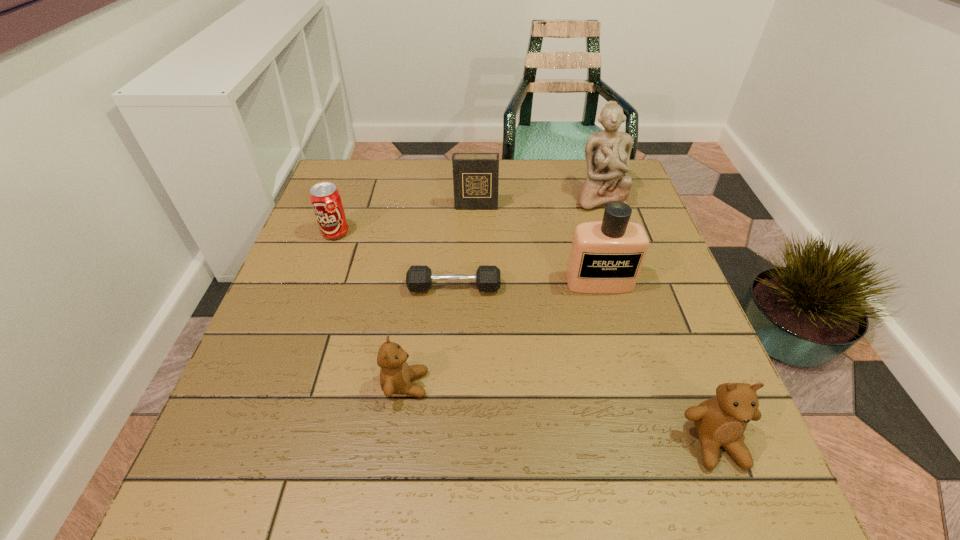
If equal spacing is the goal by inserting an additional teddy_bear among them, please point out a vacant space for this new teddy_bear. Please provide its 2D coordinates. Your answer should be formatted as a tuple, i.e. [(x, y)], where the tuple contains the x and y coordinates of a point satisfying the conditions above.

[(553, 412)]